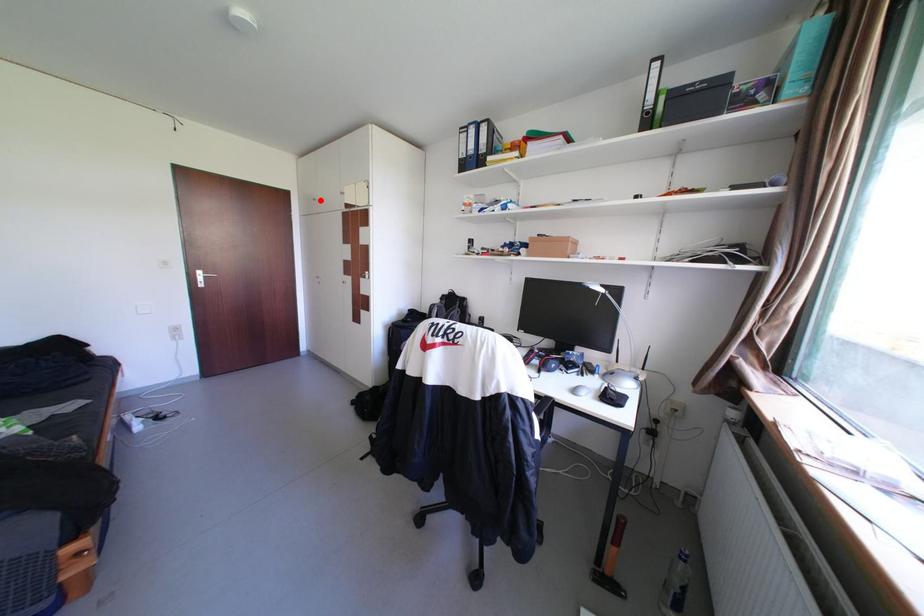
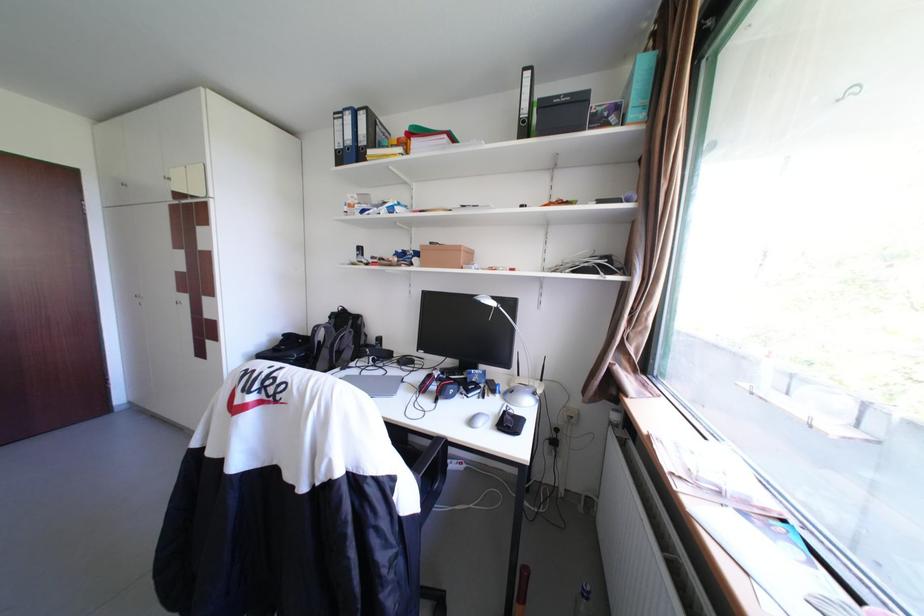
The point at the highlighted location is marked in the first image. Where is the corresponding point in the second image?

(130, 185)